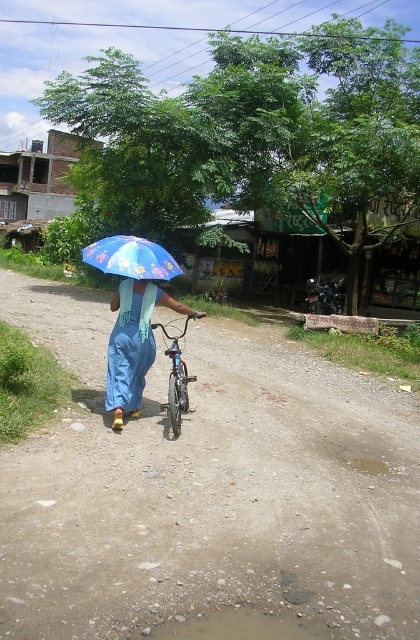
Question: Which object appears closest to the camera in this image?

Choices:
 (A) shiny metallic bicycle at center
 (B) brown gravel dirt track at center
 (C) blue printed umbrella at center

Answer: (B)

Question: Does blue printed umbrella at center appear on the left side of shiny metallic bicycle at center?

Choices:
 (A) no
 (B) yes

Answer: (B)

Question: Which point is closer to the camera taking this photo?

Choices:
 (A) (99, 248)
 (B) (173, 410)
 (C) (67, 458)

Answer: (C)

Question: Which point appears closest to the camera in this image?

Choices:
 (A) (175, 275)
 (B) (136, 339)
 (C) (222, 611)
 (D) (178, 410)

Answer: (C)

Question: Does brown gravel dirt track at center appear on the right side of shiny metallic bicycle at center?

Choices:
 (A) no
 (B) yes

Answer: (A)

Question: Considering the relative positions of blue printed umbrella at center and shiny metallic bicycle at center in the image provided, where is blue printed umbrella at center located with respect to shiny metallic bicycle at center?

Choices:
 (A) below
 (B) above

Answer: (B)